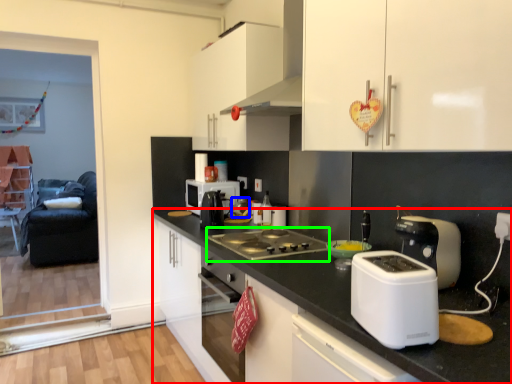
Question: Which object is positioned farthest from countertop (highlighted by a red box)? Select from appliance (highlighted by a blue box) and gas stove (highlighted by a green box).

Choices:
 (A) appliance
 (B) gas stove

Answer: (A)